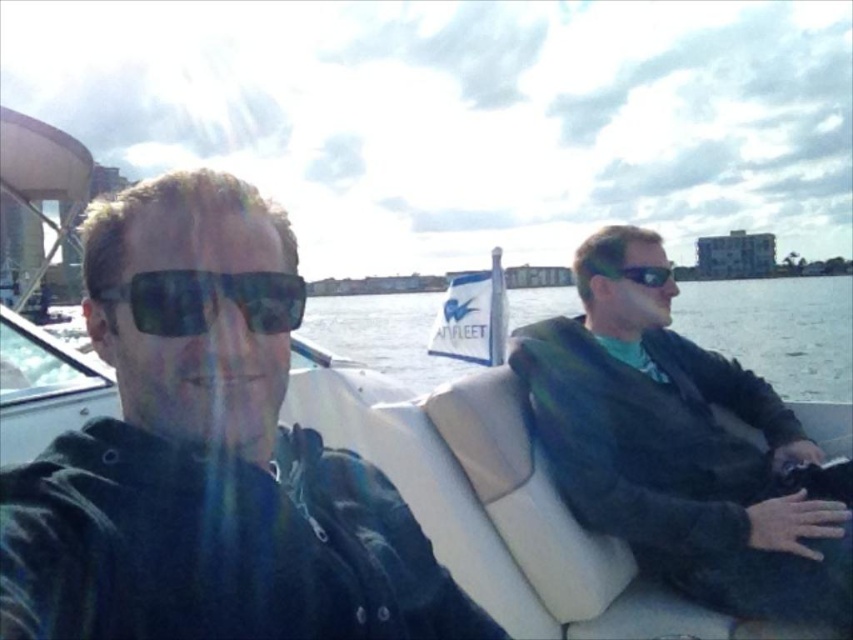
Is clear water at center smaller than black reflective sunglasses at right?

No.

Is point (780, 294) closer to viewer compared to point (643, 285)?

No, (780, 294) is behind (643, 285).

Where is `clear water at center`? clear water at center is located at coordinates (776, 330).

Does matte black jacket at left appear on the right side of black reflective sunglasses at right?

In fact, matte black jacket at left is to the left of black reflective sunglasses at right.

Can you confirm if matte black jacket at left is bigger than black reflective sunglasses at right?

Yes.

Between point (289, 451) and point (593, 264), which one is positioned behind?

The point (593, 264) is behind.

At what (x,y) coordinates should I click in order to perform the action: click on matte black jacket at left. Please return your answer as a coordinate pair (x, y). Image resolution: width=853 pixels, height=640 pixels. Looking at the image, I should click on (207, 456).

Does point (193, 310) lie in front of point (624, 269)?

Yes, it is.

Identify the location of matte black sunglasses at left. Image resolution: width=853 pixels, height=640 pixels. point(207,300).

You are a GUI agent. You are given a task and a screenshot of the screen. Output one action in this format:
    pyautogui.click(x=<x>, y=<y>)
    Task: Click on the matte black sunglasses at left
    Image resolution: width=853 pixels, height=640 pixels.
    Given the screenshot: What is the action you would take?
    point(207,300)